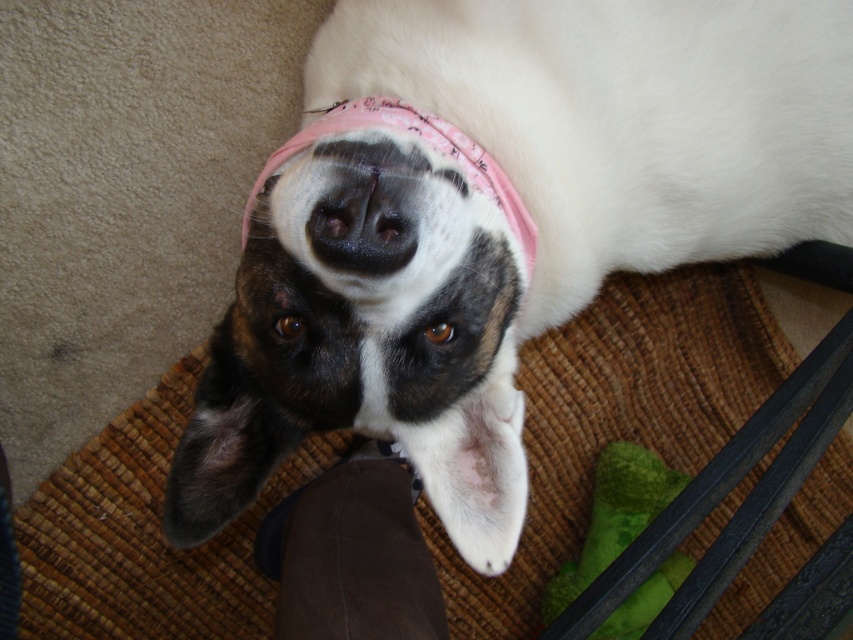
Question: Considering the real-world distances, which object is closest to the pink fabric bandana at center?

Choices:
 (A) white soft fur at center
 (B) green rubber bone at lower right

Answer: (A)

Question: Which object is positioned closest to the pink fabric bandana at center?

Choices:
 (A) black smooth nose at center
 (B) white soft fur at center

Answer: (B)

Question: Is the position of green rubber bone at lower right more distant than that of pink fabric bandana at center?

Choices:
 (A) yes
 (B) no

Answer: (A)

Question: Which point is closer to the camera?

Choices:
 (A) (462, 60)
 (B) (399, 193)
 (C) (514, 204)
 (D) (616, 461)

Answer: (B)

Question: In this image, where is green rubber bone at lower right located relative to black smooth nose at center?

Choices:
 (A) below
 (B) above

Answer: (A)

Question: Is black smooth nose at center smaller than pink fabric bandana at center?

Choices:
 (A) yes
 (B) no

Answer: (A)